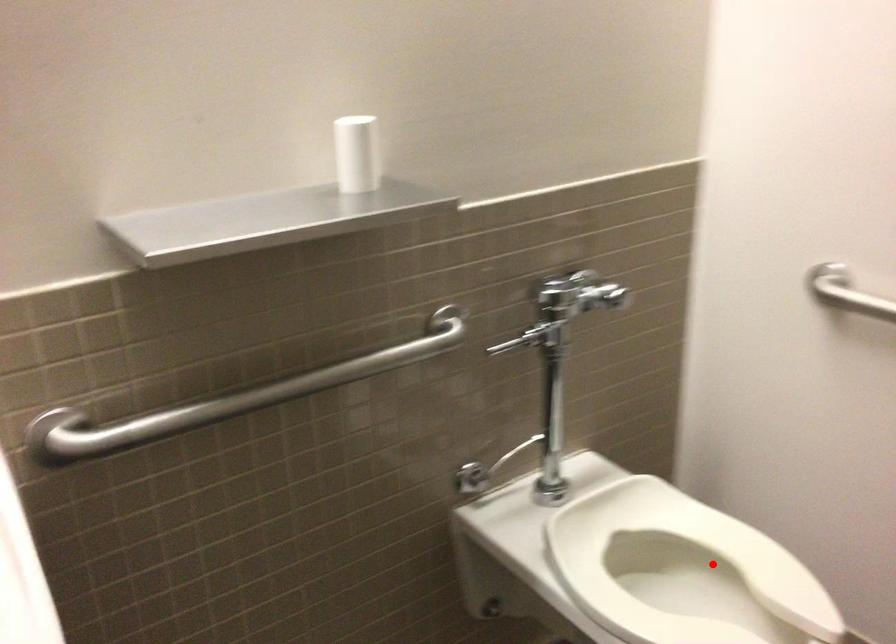
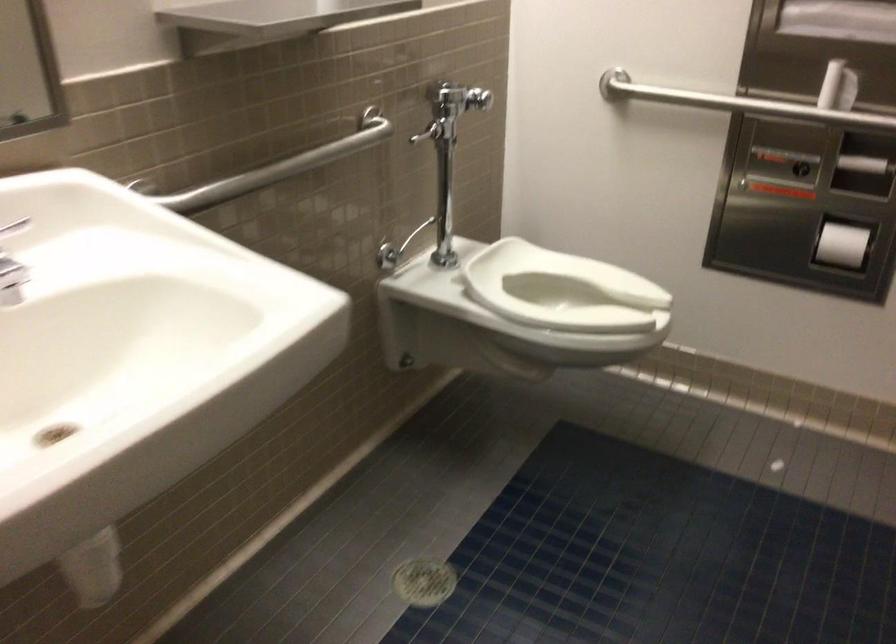
Question: I am providing you with two images of the same scene from different viewpoints. In image1, a red point is highlighted. Considering the same 3D point in image2, which of the following is correct?

Choices:
 (A) It is closer
 (B) It is farther

Answer: (B)